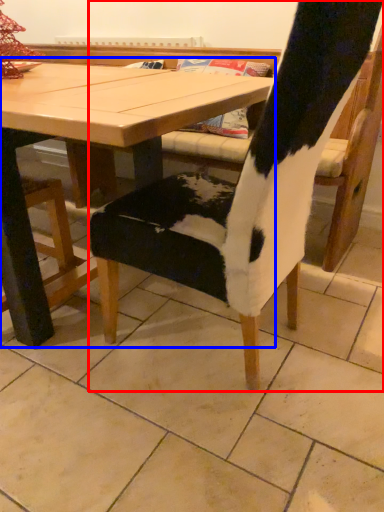
Question: Among these objects, which one is nearest to the camera, chair (highlighted by a red box) or table (highlighted by a blue box)?

Choices:
 (A) chair
 (B) table

Answer: (A)